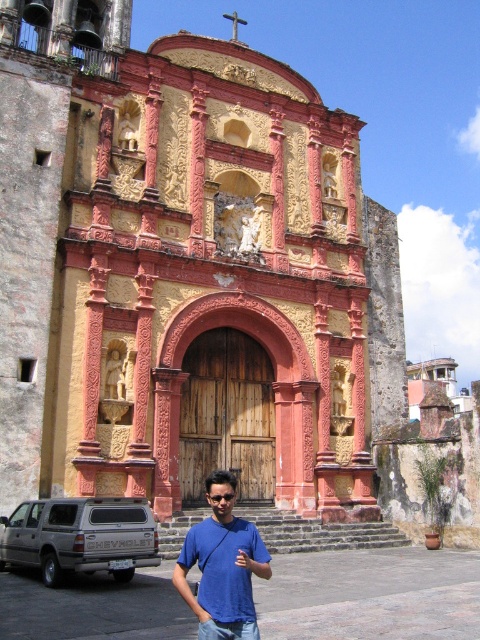
Question: Among these objects, which one is farthest from the camera?

Choices:
 (A) yellowish-pink stone church at center
 (B) blue cotton shirt at center

Answer: (A)

Question: Is yellowish-pink stone church at center wider than blue cotton shirt at center?

Choices:
 (A) no
 (B) yes

Answer: (B)

Question: Which point is farther to the camera?

Choices:
 (A) (186, 566)
 (B) (184, 282)

Answer: (B)

Question: Can you confirm if yellowish-pink stone church at center is positioned below blue cotton shirt at center?

Choices:
 (A) yes
 (B) no

Answer: (B)

Question: Which object appears farthest from the camera in this image?

Choices:
 (A) blue cotton shirt at center
 (B) yellowish-pink stone church at center

Answer: (B)

Question: Considering the relative positions of yellowish-pink stone church at center and blue cotton shirt at center in the image provided, where is yellowish-pink stone church at center located with respect to blue cotton shirt at center?

Choices:
 (A) left
 (B) right

Answer: (B)